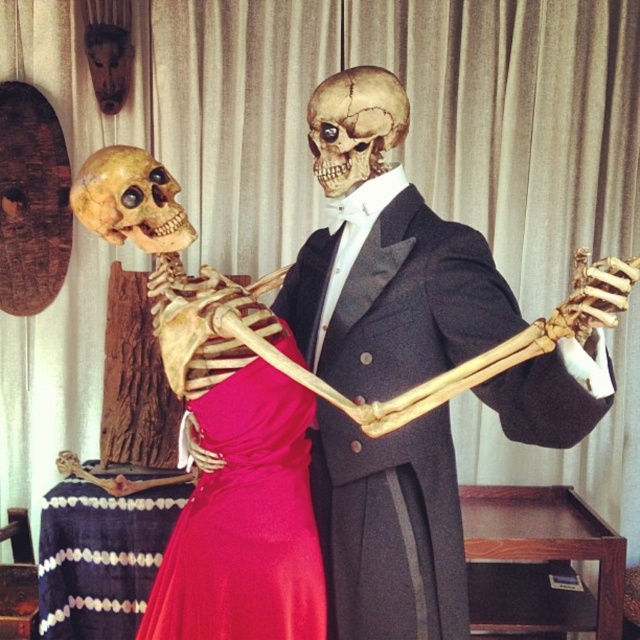
Is shiny red fabric dress at center positioned in front of golden matte skull at center?

No, shiny red fabric dress at center is further to the viewer.

Can you confirm if shiny red fabric dress at center is smaller than golden matte skull at center?

Actually, shiny red fabric dress at center might be larger than golden matte skull at center.

What do you see at coordinates (244, 522) in the screenshot? I see `shiny red fabric dress at center` at bounding box center [244, 522].

At what (x,y) coordinates should I click in order to perform the action: click on shiny red fabric dress at center. Please return your answer as a coordinate pair (x, y). Looking at the image, I should click on (244, 522).

Does matte pink dress at center have a greater width compared to smooth beige skull at center?

Yes, matte pink dress at center is wider than smooth beige skull at center.

Looking at this image, who is more distant from viewer, (532,428) or (344,102)?

Positioned behind is point (344,102).

This screenshot has width=640, height=640. In order to click on matte pink dress at center in this screenshot , I will do `click(392, 292)`.

Which of these two, shiny red fabric dress at center or smooth beige skull at center, stands taller?

With more height is shiny red fabric dress at center.

Is point (172, 611) closer to camera compared to point (344, 163)?

Yes.

Where is `shiny red fabric dress at center`? The height and width of the screenshot is (640, 640). shiny red fabric dress at center is located at coordinates (244, 522).